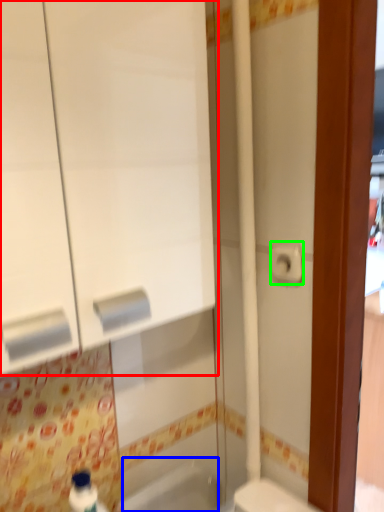
Question: Which is nearer to the medicine cabinet (highlighted by a red box)? bath (highlighted by a blue box) or toilet paper (highlighted by a green box).

Choices:
 (A) bath
 (B) toilet paper

Answer: (B)